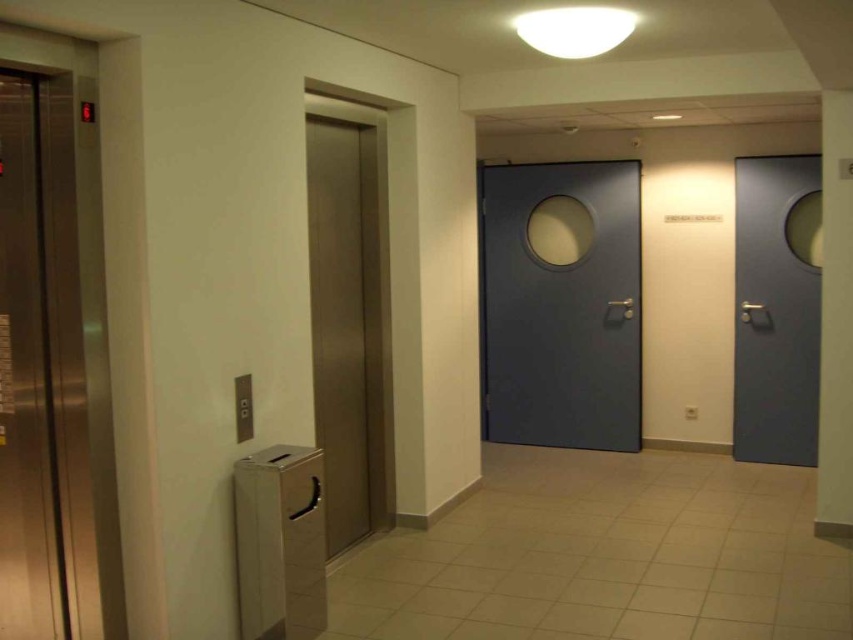
Is polished stainless steel elevator at left thinner than matte gray door at center?

Indeed, polished stainless steel elevator at left has a lesser width compared to matte gray door at center.

Is polished stainless steel elevator at left closer to the viewer compared to matte gray door at center?

Yes, it is in front of matte gray door at center.

Who is more forward, (22, 440) or (572, 406)?

Point (22, 440) is in front.

The width and height of the screenshot is (853, 640). In order to click on polished stainless steel elevator at left in this screenshot , I will do `click(54, 368)`.

Between polished stainless steel elevator at left and metallic silver trash can at lower left, which one is positioned lower?

Positioned lower is metallic silver trash can at lower left.

Find the location of a particular element. polished stainless steel elevator at left is located at coordinates (54, 368).

This screenshot has width=853, height=640. Identify the location of polished stainless steel elevator at left. (54, 368).

Does wooden door at center have a smaller size compared to metallic silver trash can at lower left?

Actually, wooden door at center might be larger than metallic silver trash can at lower left.

Does point (329, 344) lie in front of point (287, 550)?

No, (329, 344) is further to viewer.

Identify the location of wooden door at center. This screenshot has width=853, height=640. (339, 324).